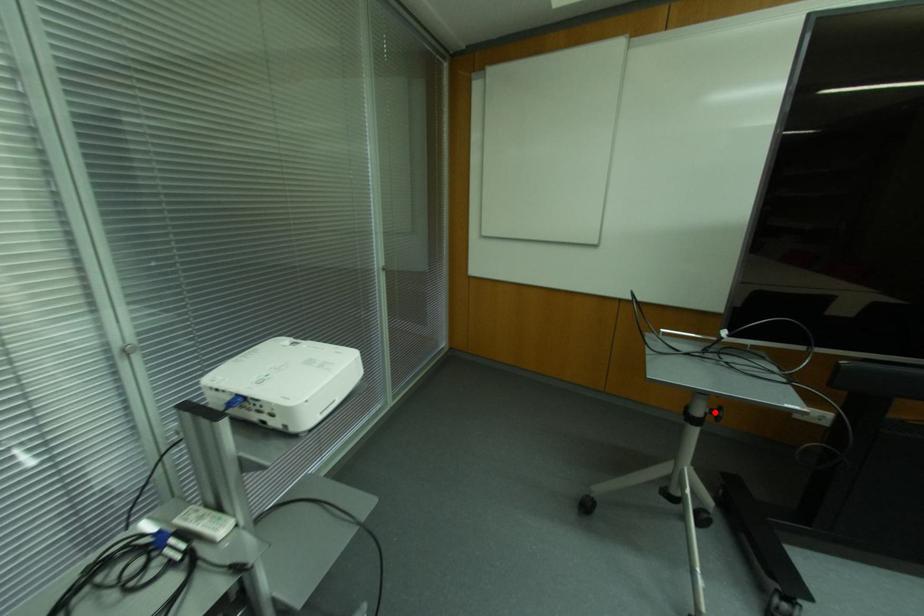
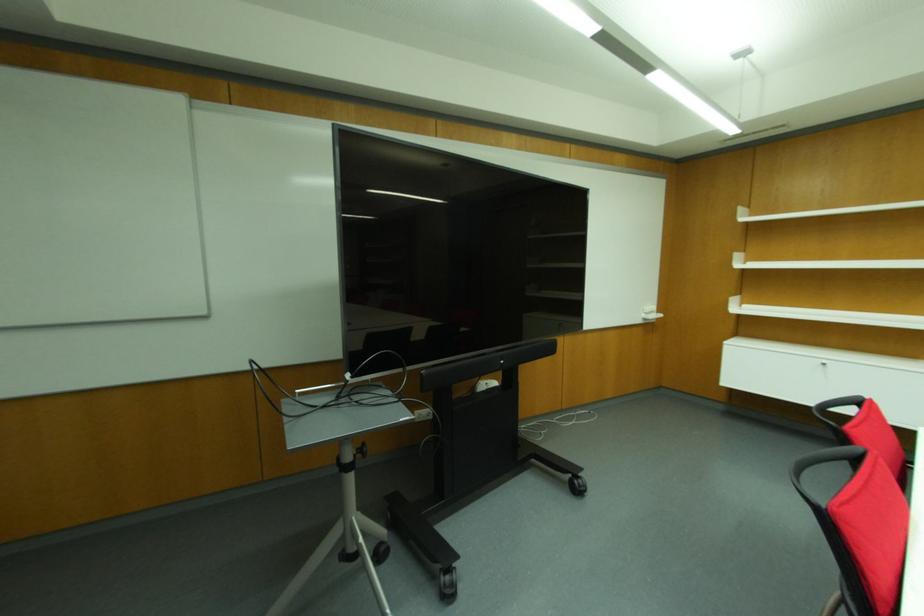
Find the pixel in the second image that matches the highlighted location in the first image.

(360, 450)